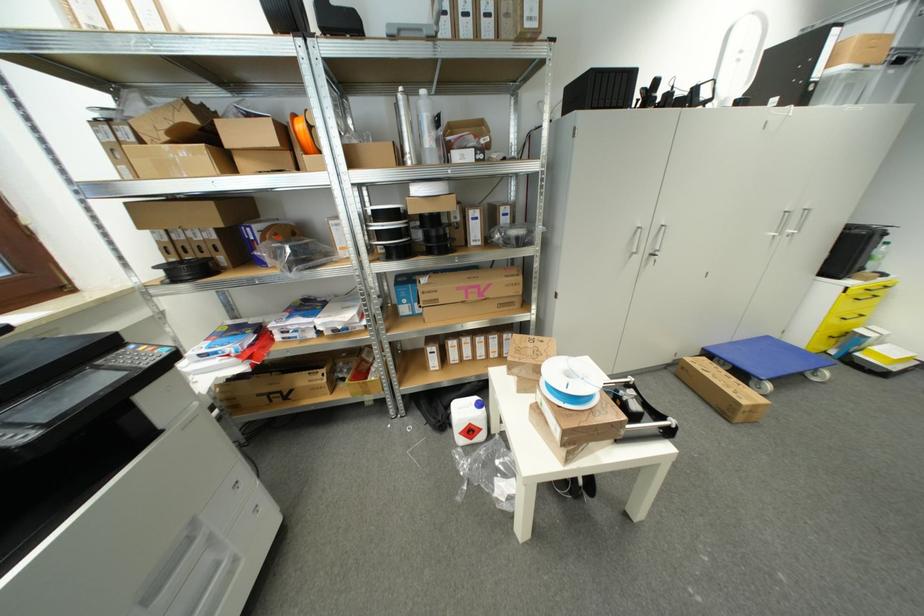
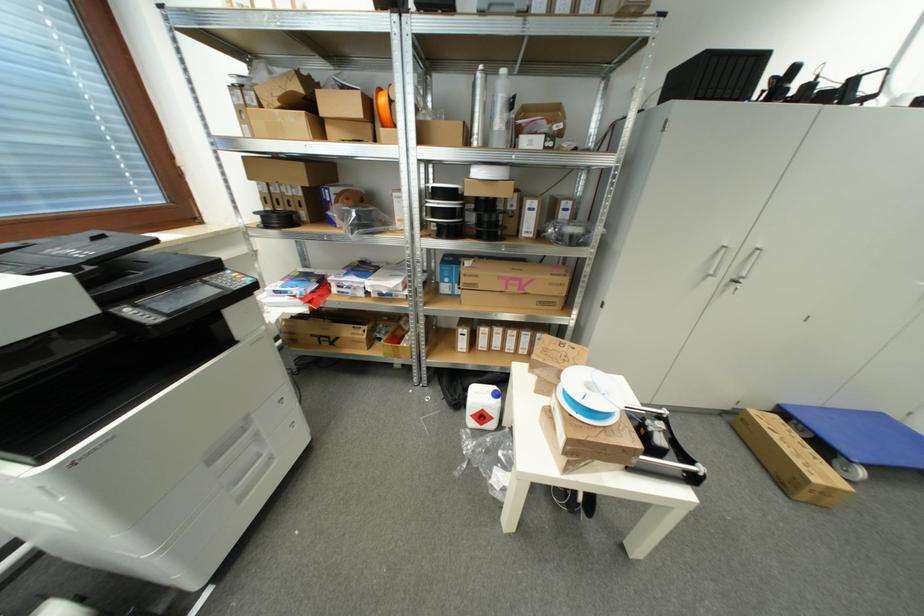
Question: The first image is from the beginning of the video and the second image is from the end. How did the camera likely rotate when shooting the video?

Choices:
 (A) Left
 (B) Right
 (C) Up
 (D) Down

Answer: (A)